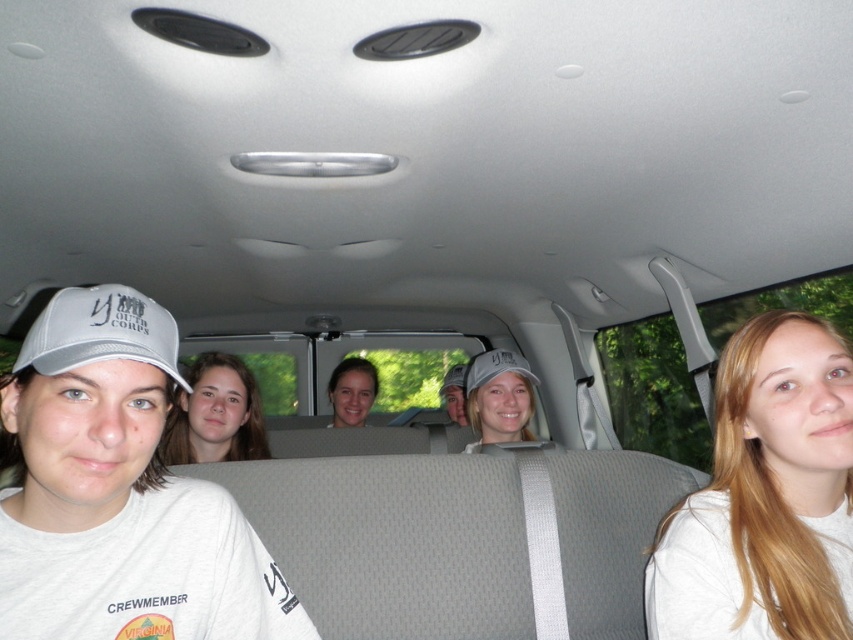
Does blonde hair at right come in front of smooth skin face at center?

Yes, blonde hair at right is in front of smooth skin face at center.

Between point (801, 506) and point (339, 381), which one is positioned behind?

Positioned behind is point (339, 381).

Identify the location of blonde hair at right. (766, 497).

Between blonde hair at right and blonde hair at center, which one is positioned lower?

blonde hair at right is lower down.

Is blonde hair at right below blonde hair at center?

Yes.

Which is behind, point (814, 371) or point (210, 442)?

The point (210, 442) is more distant.

Where is `blonde hair at right`? The height and width of the screenshot is (640, 853). blonde hair at right is located at coordinates (766, 497).

Can you confirm if matte gray cap at center is taller than gray fabric baseball cap at center?

Yes, matte gray cap at center is taller than gray fabric baseball cap at center.

Does matte gray cap at center lie behind gray fabric baseball cap at center?

No, it is in front of gray fabric baseball cap at center.

Describe the element at coordinates (498, 397) in the screenshot. I see `matte gray cap at center` at that location.

The image size is (853, 640). What are the coordinates of `matte gray cap at center` in the screenshot? It's located at (498, 397).